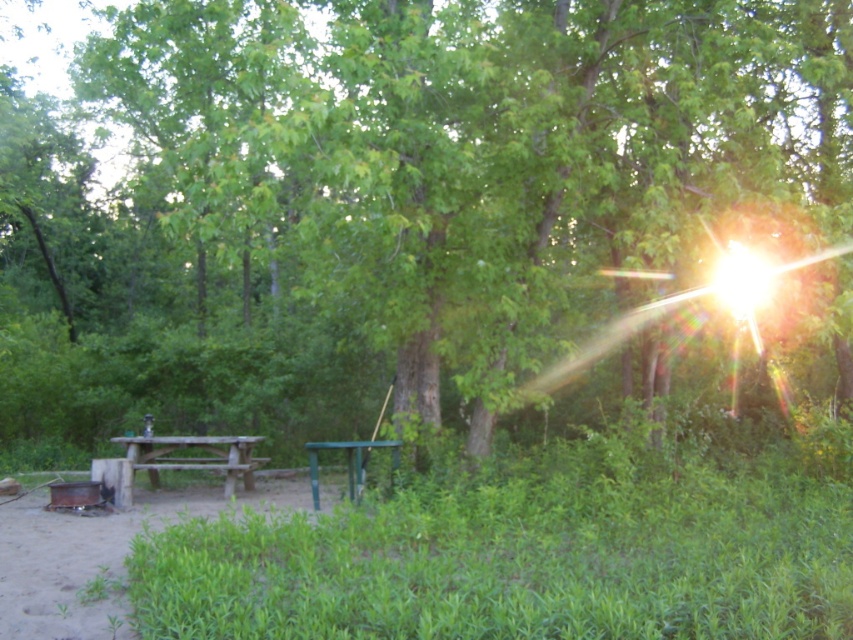
Between wooden picnic table at left and green plastic table at center, which one appears on the right side from the viewer's perspective?

green plastic table at center

Between wooden picnic table at left and green plastic table at center, which one is positioned higher?

green plastic table at center is above.

Which is in front, point (173, 444) or point (351, 468)?

Point (351, 468) is more forward.

Locate an element on the screen. The image size is (853, 640). wooden picnic table at left is located at coordinates (195, 458).